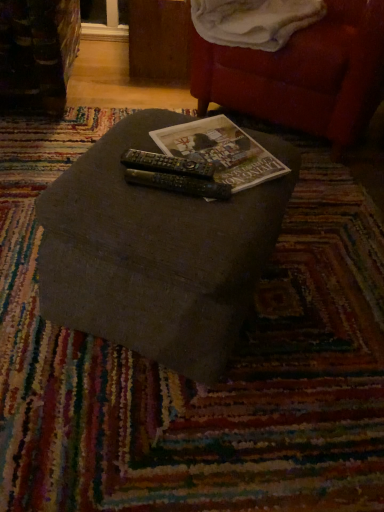
Find the location of `vacant area that is in front of textured gray ottoman at center`. vacant area that is in front of textured gray ottoman at center is located at coordinates (162, 425).